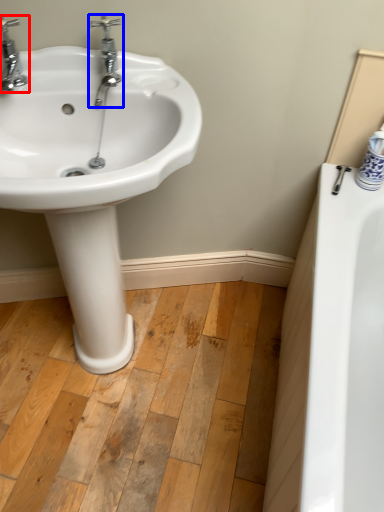
Question: Among these objects, which one is farthest to the camera, tap (highlighted by a red box) or tap (highlighted by a blue box)?

Choices:
 (A) tap
 (B) tap

Answer: (B)